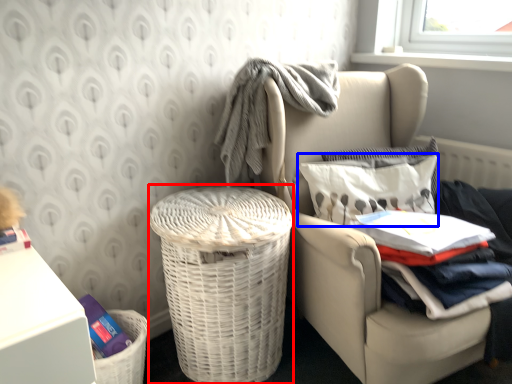
Question: Among these objects, which one is farthest to the camera, shopping basket (highlighted by a red box) or pillow (highlighted by a blue box)?

Choices:
 (A) shopping basket
 (B) pillow

Answer: (B)